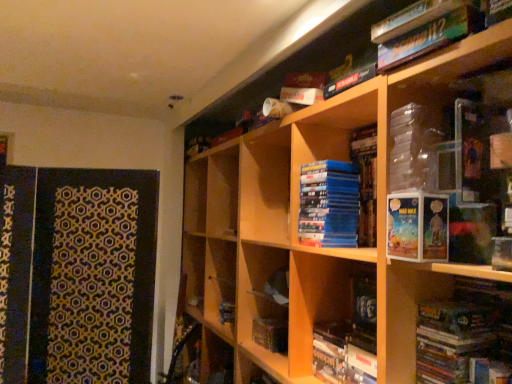
Question: Does matte black book at lower right, placed as the 3th book when sorted from top to bottom, have a greater height compared to green cardboard book at upper right, acting as the 4th book starting from the bottom?

Choices:
 (A) yes
 (B) no

Answer: (A)

Question: Can you confirm if matte black book at lower right, which ranks as the second book in bottom-to-top order, is bigger than green cardboard book at upper right, acting as the first book starting from the top?

Choices:
 (A) no
 (B) yes

Answer: (B)

Question: Would you say green cardboard book at upper right, acting as the first book starting from the top, is part of matte black book at lower right, placed as the 3th book when sorted from top to bottom,'s contents?

Choices:
 (A) yes
 (B) no

Answer: (B)

Question: Could you tell me if matte black book at lower right, placed as the 3th book when sorted from top to bottom, is facing green cardboard book at upper right, acting as the first book starting from the top?

Choices:
 (A) no
 (B) yes

Answer: (A)

Question: Is matte black book at lower right, placed as the 3th book when sorted from top to bottom, not near green cardboard book at upper right, acting as the 4th book starting from the bottom?

Choices:
 (A) yes
 (B) no

Answer: (B)

Question: Is matte black book at lower right, placed as the 3th book when sorted from top to bottom, to the right of green cardboard book at upper right, acting as the 4th book starting from the bottom, from the viewer's perspective?

Choices:
 (A) no
 (B) yes

Answer: (A)

Question: Does matte blue book at lower center, the 1th book positioned from the bottom, come behind matte cardboard book at center-right?

Choices:
 (A) no
 (B) yes

Answer: (B)

Question: From the image's perspective, would you say matte blue book at lower center, which is the fourth book in top-to-bottom order, is shown under matte cardboard book at center-right?

Choices:
 (A) no
 (B) yes

Answer: (B)

Question: Does matte blue book at lower center, which is the fourth book in top-to-bottom order, have a greater width compared to matte cardboard book at center-right?

Choices:
 (A) no
 (B) yes

Answer: (A)

Question: Is matte blue book at lower center, the 1th book positioned from the bottom, facing towards matte cardboard book at center-right?

Choices:
 (A) yes
 (B) no

Answer: (B)

Question: From the image's perspective, is matte blue book at lower center, which is the fourth book in top-to-bottom order, on matte cardboard book at center-right?

Choices:
 (A) no
 (B) yes

Answer: (A)

Question: Is matte blue book at lower center, which is the fourth book in top-to-bottom order, facing away from matte cardboard book at center-right?

Choices:
 (A) no
 (B) yes

Answer: (A)

Question: Would you consider wooden bookcase at upper right to be distant from matte black book at lower right, placed as the 3th book when sorted from top to bottom?

Choices:
 (A) no
 (B) yes

Answer: (A)